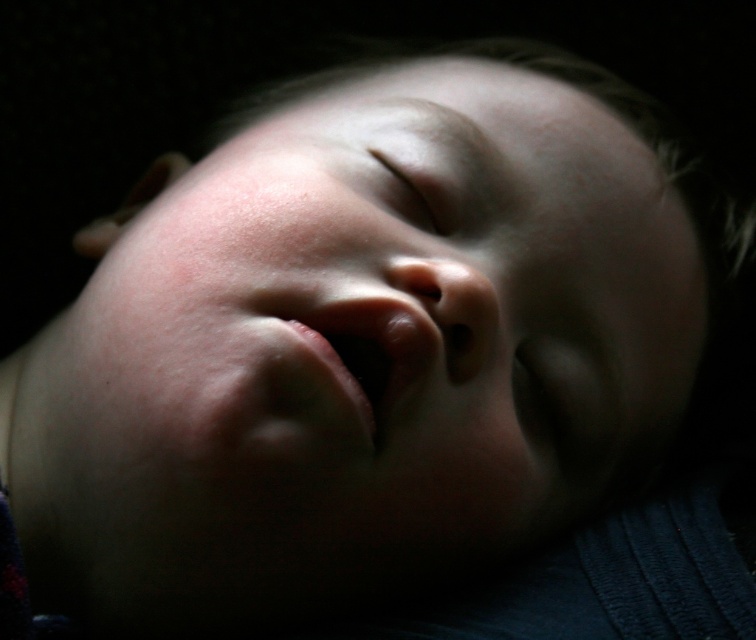
How far apart are the pink smooth lips at center?

The pink smooth lips at center are 18.13 inches apart.

You are a photographer adjusting the lighting for a portrait. You have two light sources positioned at point (x=420, y=508) and point (x=451, y=173). Based on the scene, which light source is closer to the camera?

Point (x=420, y=508) is in front of point (x=451, y=173), so the light source at point (x=420, y=508) is closer to the camera.